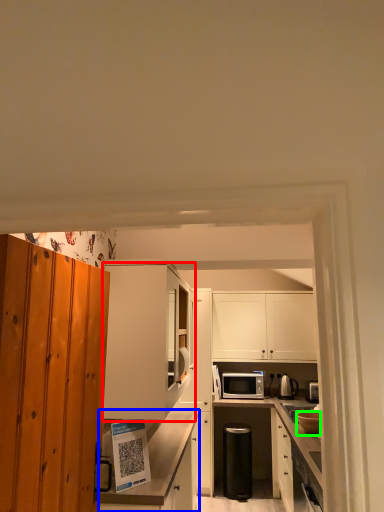
Question: Considering the real-world distances, which object is closest to cabinetry (highlighted by a red box)? cabinetry (highlighted by a blue box) or appliance (highlighted by a green box).

Choices:
 (A) cabinetry
 (B) appliance

Answer: (A)